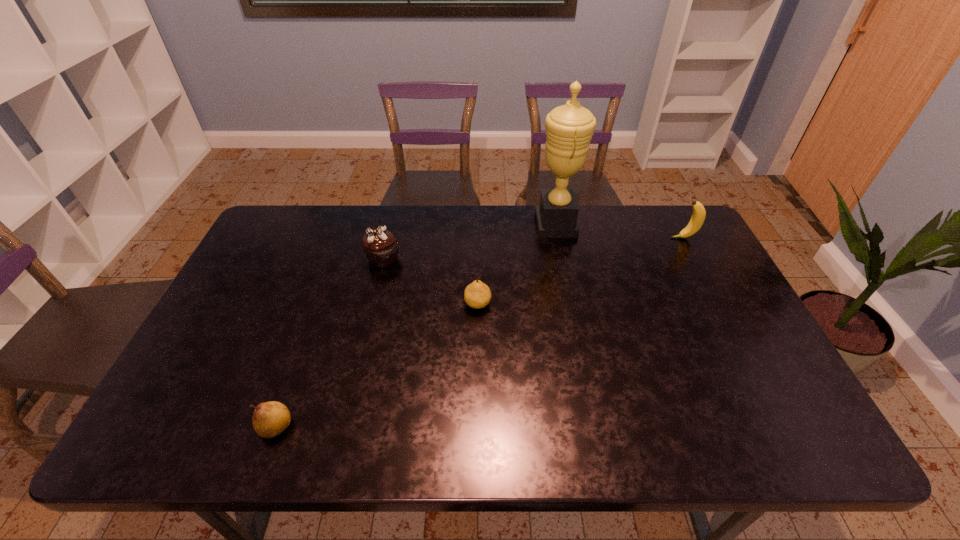
Where is `banana at the far edge`? banana at the far edge is located at coordinates (698, 216).

Locate an element on the screen. This screenshot has width=960, height=540. cupcake located in the far edge section of the desktop is located at coordinates (x=380, y=246).

The image size is (960, 540). I want to click on object present at the near edge, so click(x=270, y=419).

I want to click on object positioned at the right edge, so click(x=698, y=216).

Find the location of a particular element. object positioned at the far right corner is located at coordinates (698, 216).

I want to click on free space at the far edge of the desktop, so click(593, 214).

Find the location of a particular element. Image resolution: width=960 pixels, height=540 pixels. free location at the near edge is located at coordinates (569, 424).

At what (x,y) coordinates should I click in order to perform the action: click on free space at the left edge of the desktop. Please return your answer as a coordinate pair (x, y). Looking at the image, I should click on (258, 305).

In the image, there is a desktop. Find the location of `vacant area at the right edge`. vacant area at the right edge is located at coordinates (695, 284).

In the image, there is a desktop. Find the location of `free region at the far left corner`. free region at the far left corner is located at coordinates (286, 213).